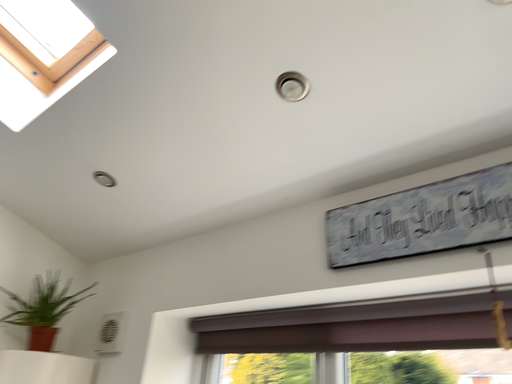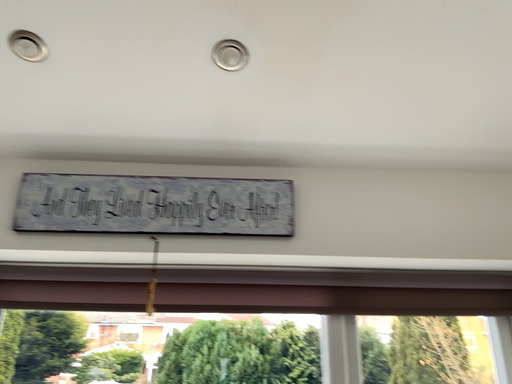
Question: How did the camera likely rotate when shooting the video?

Choices:
 (A) rotated downward
 (B) rotated upward

Answer: (A)